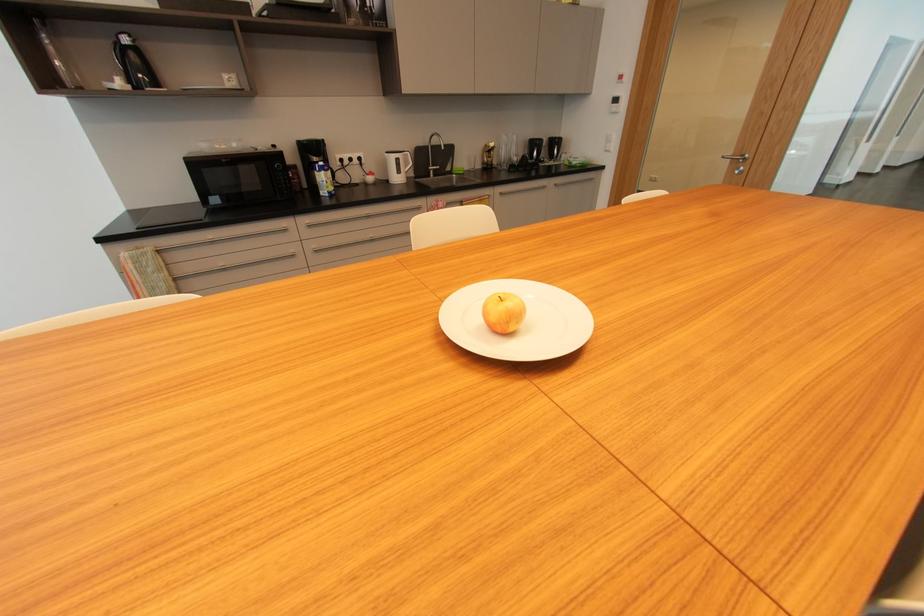
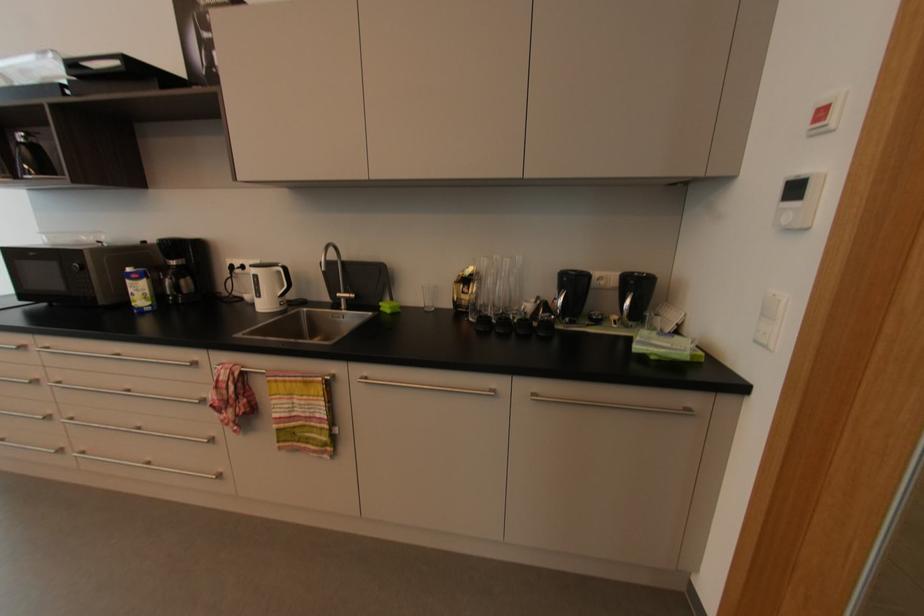
Where in the second image is the point corresponding to (x=581, y=166) from the first image?

(657, 358)